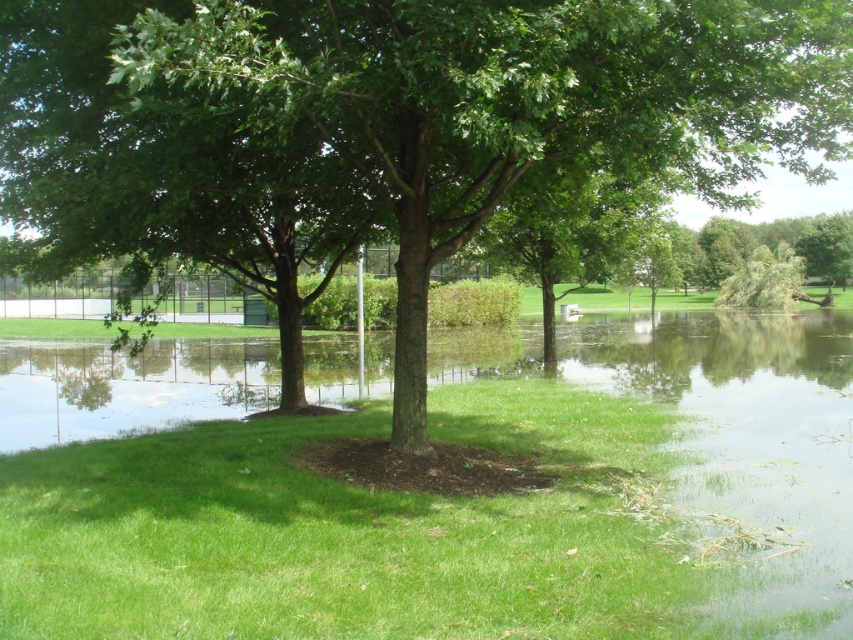
You are a park visitor who wants to take a photo of both the green leafy tree at center and the green leafy tree at right. Which tree should you stand closer to in order to capture both in a single frame?

You should stand closer to the green leafy tree at right because it is narrower than the green leafy tree at center, allowing both to fit within the camera frame when positioned closer to the narrower tree.

You are a park visitor who wants to walk from the green leafy tree at center to the green leafy tree at right. Based on the scene, which direction should you walk to avoid the flooded area?

The green leafy tree at center is below the green leafy tree at right, so you should walk upwards to avoid the flooded area.